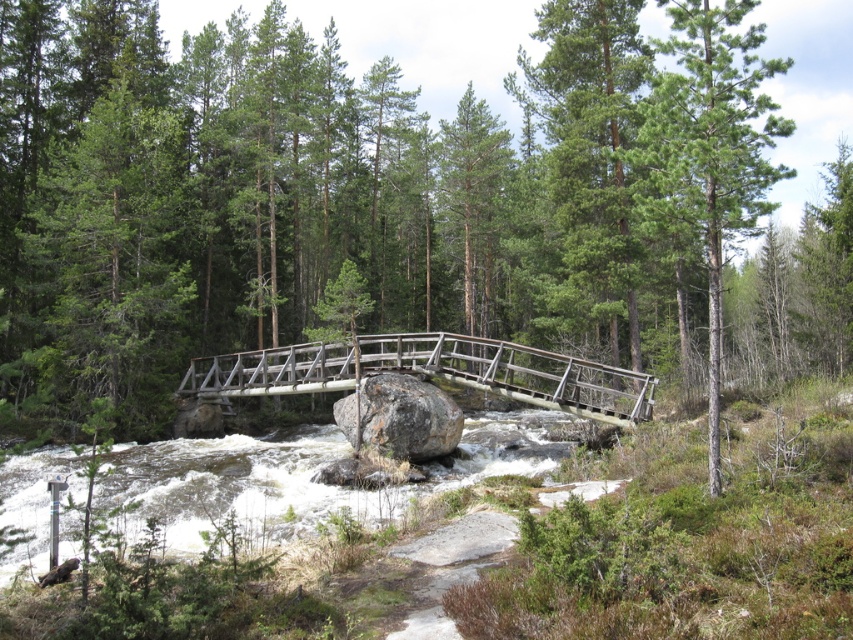
You are a hiker standing on the wooden bridge at center and want to reach the gray rough boulder at center. Which direction should you walk to get closer to the boulder?

The wooden bridge at center is positioned on the right side of the gray rough boulder at center. To reach the boulder, walk to the left side of the bridge.

Looking at this image, you are a hiker standing on the wooden footbridge and notice the white frothy water at center and the gray rough boulder at center. Which object is located below the other?

The white frothy water at center is positioned under the gray rough boulder at center, so the gray rough boulder at center is above the white frothy water at center.